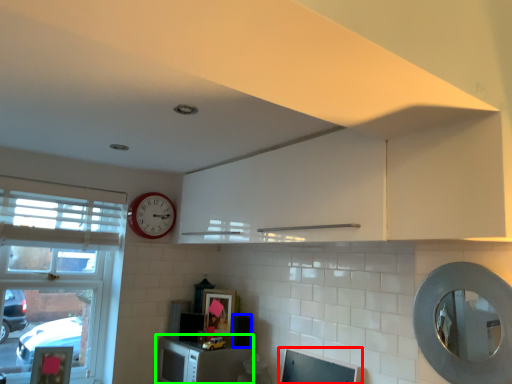
Question: Considering the real-world distances, which object is farthest from computer monitor (highlighted by a red box)? appliance (highlighted by a blue box) or cabinetry (highlighted by a green box)?

Choices:
 (A) appliance
 (B) cabinetry

Answer: (A)